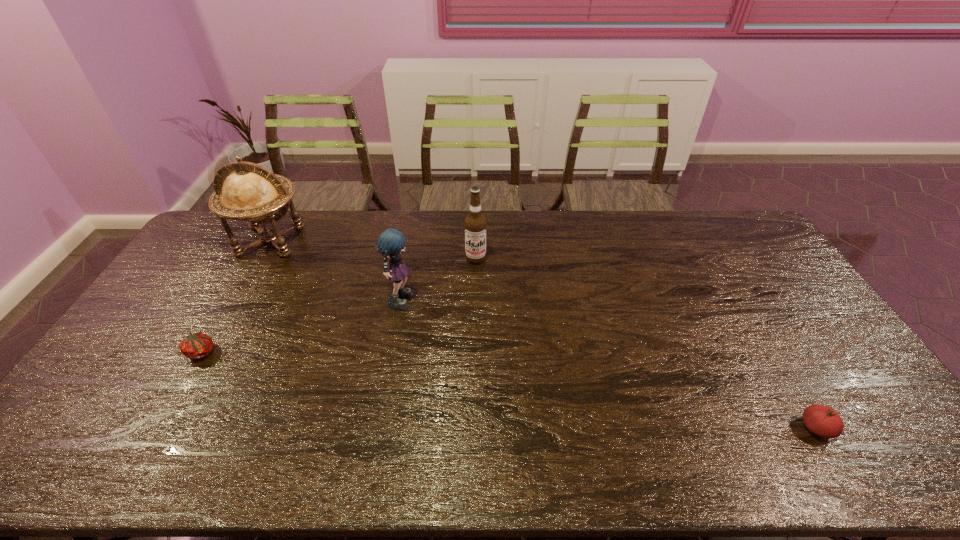
Locate an element on the screen. The image size is (960, 540). the tallest object is located at coordinates (251, 192).

Find the location of a particular element. the fourth object from left to right is located at coordinates (475, 223).

This screenshot has height=540, width=960. I want to click on the third object from right to left, so click(391, 242).

Find the location of a particular element. The width and height of the screenshot is (960, 540). rag doll is located at coordinates (391, 242).

This screenshot has width=960, height=540. What are the coordinates of `the nearest object` in the screenshot? It's located at (824, 421).

The width and height of the screenshot is (960, 540). I want to click on the rightmost object, so click(824, 421).

The height and width of the screenshot is (540, 960). I want to click on the fourth farthest object, so click(198, 345).

Where is `the farther tomato`? Image resolution: width=960 pixels, height=540 pixels. the farther tomato is located at coordinates (198, 345).

I want to click on vacant area located 0.320m on the front-facing side of the globe, so click(217, 337).

The image size is (960, 540). In order to click on free location located 0.280m on the label of the alcohol in this screenshot , I will do `click(475, 327)`.